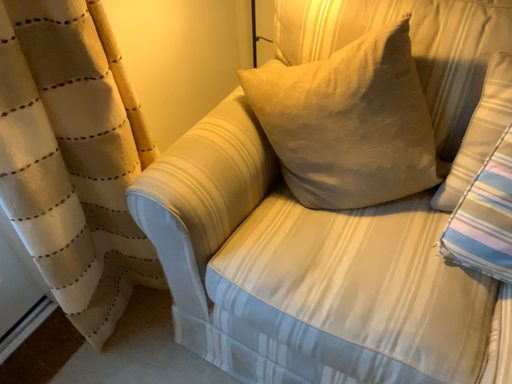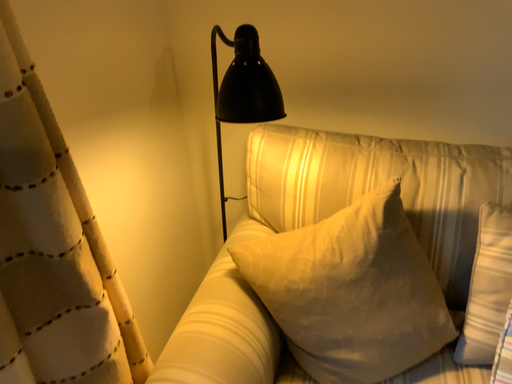
Question: Which way did the camera rotate in the video?

Choices:
 (A) rotated left
 (B) rotated right

Answer: (B)